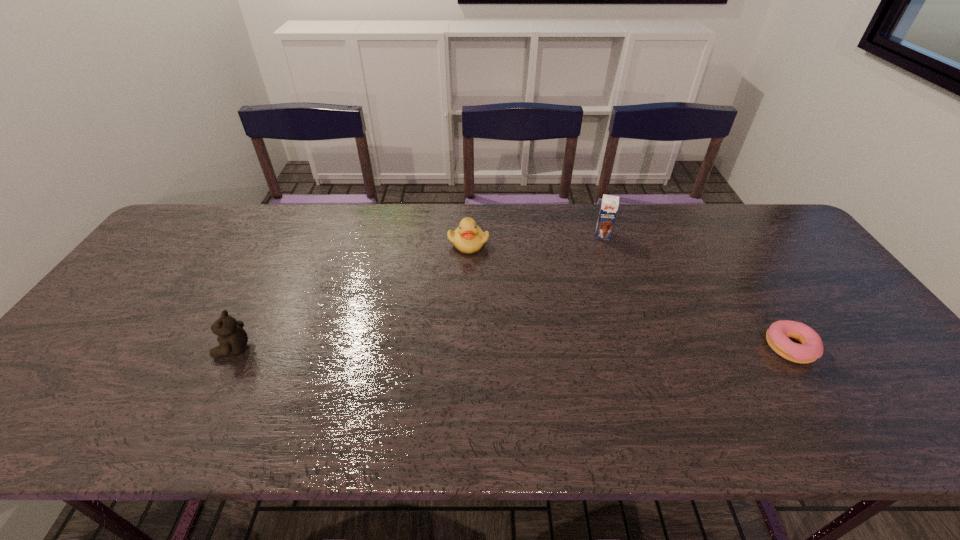
In order to click on the second tallest object in this screenshot , I will do `click(232, 338)`.

You are a GUI agent. You are given a task and a screenshot of the screen. Output one action in this format:
    pyautogui.click(x=<x>, y=<y>)
    Task: Click on the teddy bear
    The height and width of the screenshot is (540, 960).
    Given the screenshot: What is the action you would take?
    pyautogui.click(x=232, y=338)

Find the location of a particular element. This screenshot has height=540, width=960. doughnut is located at coordinates (811, 347).

Where is `the rightmost object`? the rightmost object is located at coordinates (811, 347).

Find the location of a particular element. This screenshot has width=960, height=540. duckling is located at coordinates (468, 238).

In order to click on the second object from left to right in this screenshot , I will do (468, 238).

Find the location of a particular element. The image size is (960, 540). the second object from right to left is located at coordinates (609, 206).

Locate an element on the screen. This screenshot has height=540, width=960. chocolate milk is located at coordinates (609, 206).

At what (x,y) coordinates should I click in order to perform the action: click on blank space located 0.360m on the face of the leftmost object. Please return your answer as a coordinate pair (x, y). The image size is (960, 540). Looking at the image, I should click on (69, 349).

The height and width of the screenshot is (540, 960). In order to click on vacant space situated 0.200m on the face of the leftmost object in this screenshot , I will do `click(134, 349)`.